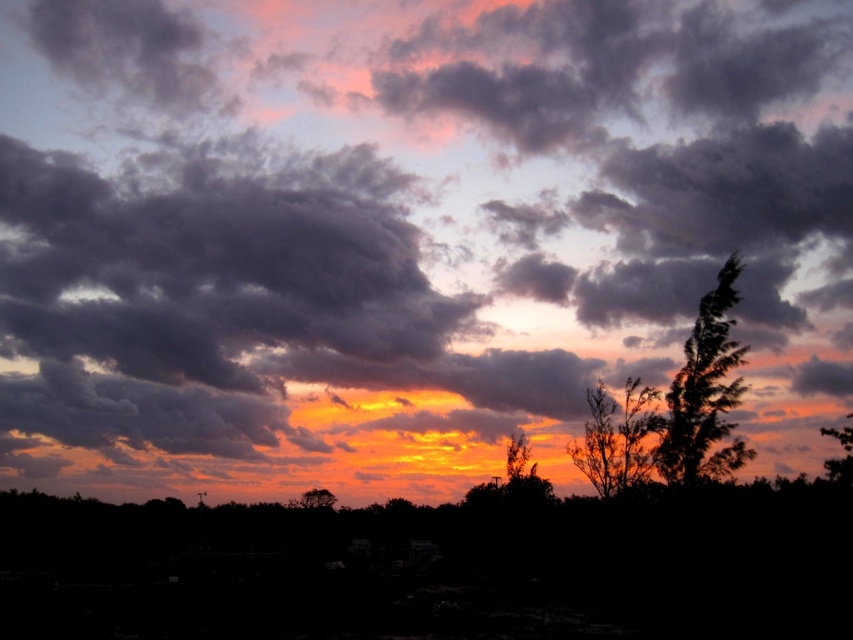
Question: Which of the following is the farthest from the observer?

Choices:
 (A) silky brown tree at center
 (B) silky green leafy tree at right

Answer: (A)

Question: Is silhouette leafy tree at upper right to the left of silky brown tree at center from the viewer's perspective?

Choices:
 (A) yes
 (B) no

Answer: (B)

Question: Does silhouette leafy tree at upper right appear under silhouette leafy tree at center?

Choices:
 (A) no
 (B) yes

Answer: (A)

Question: Which point appears farthest from the camera in this image?

Choices:
 (A) (596, 412)
 (B) (325, 504)

Answer: (B)

Question: Does silhouette leafy tree at center have a larger size compared to silky green leafy tree at right?

Choices:
 (A) no
 (B) yes

Answer: (A)

Question: Based on their relative distances, which object is nearer to the silhouette leafy tree at upper right?

Choices:
 (A) silky brown tree at center
 (B) silhouette leafy tree at center
 (C) silky green leafy tree at right

Answer: (B)